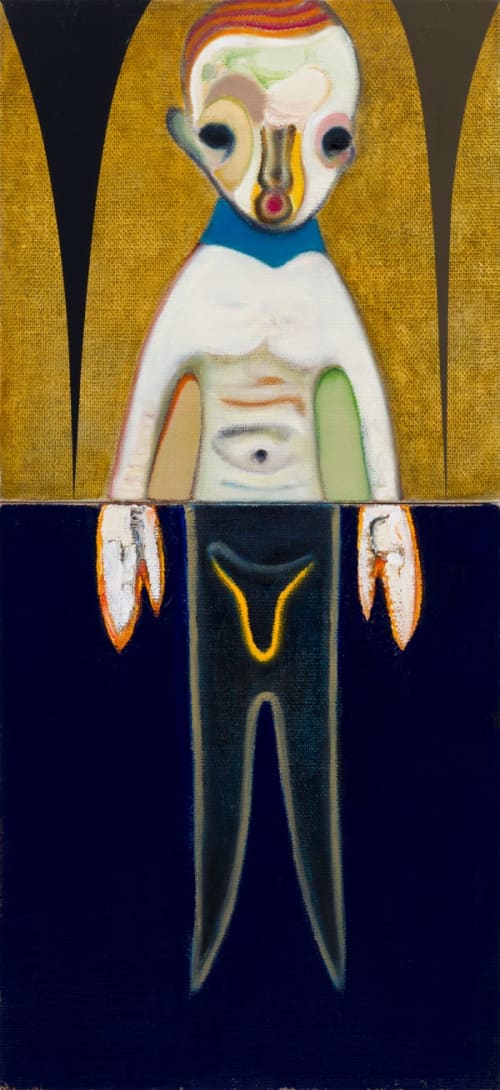
Where is `artwork illustrating a person`? artwork illustrating a person is located at coordinates (384, 233).